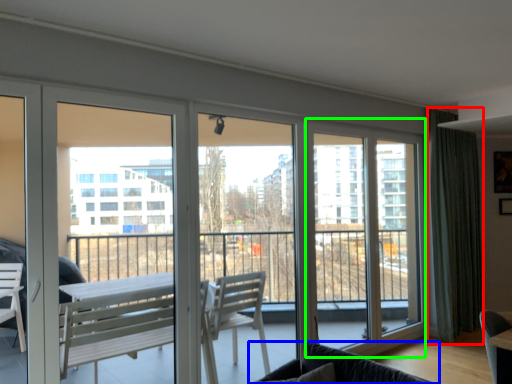
Question: Which object is the closest to the curtain (highlighted by a red box)? Choose among these: studio couch (highlighted by a blue box) or screen door (highlighted by a green box).

Choices:
 (A) studio couch
 (B) screen door

Answer: (B)